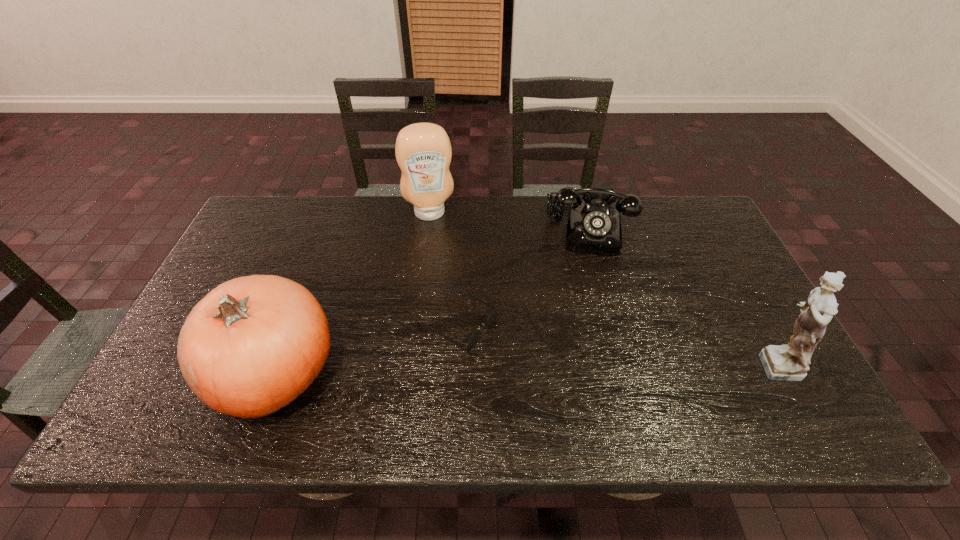
Locate an element on the screen. The height and width of the screenshot is (540, 960). the leftmost object is located at coordinates (251, 346).

What are the coordinates of `the rightmost object` in the screenshot? It's located at (790, 362).

Locate an element on the screen. condiment is located at coordinates (423, 151).

Find the location of a particular element. This screenshot has height=540, width=960. the second shortest object is located at coordinates (594, 227).

Identify the location of telephone. (594, 227).

In order to click on sunglasses in this screenshot , I will do `click(472, 338)`.

Locate an element on the screen. The width and height of the screenshot is (960, 540). free space located on the back of the leftmost object is located at coordinates (305, 291).

Locate an element on the screen. Image resolution: width=960 pixels, height=540 pixels. vacant position located on the front-facing side of the rightmost object is located at coordinates (644, 362).

At what (x,y) coordinates should I click in order to perform the action: click on vacant space located on the front-facing side of the rightmost object. Please return your answer as a coordinate pair (x, y). Looking at the image, I should click on (725, 362).

Image resolution: width=960 pixels, height=540 pixels. I want to click on free space located 0.130m on the front-facing side of the rightmost object, so click(x=690, y=362).